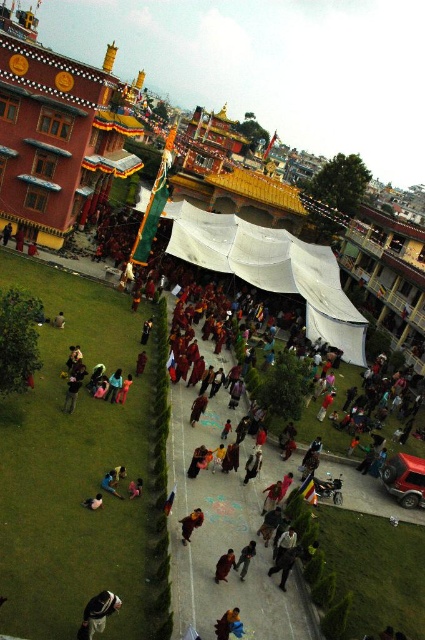
Question: Which point is closer to the camera taking this photo?

Choices:
 (A) (277, 234)
 (B) (189, 540)
 (C) (232, 556)
 (D) (133, 497)

Answer: (C)

Question: Is white fabric bag at lower left positioned at the back of light blue fabric at lower center?

Choices:
 (A) yes
 (B) no

Answer: (B)

Question: Which object is closer to the camera taking this photo?

Choices:
 (A) dark brown leather jacket at lower left
 (B) white fabric bag at lower left
 (C) white fabric canopy at center
 (D) dark brown monk at center

Answer: (B)

Question: Does orange fabric at lower center appear on the left side of dark brown leather jacket at center?

Choices:
 (A) no
 (B) yes

Answer: (B)

Question: Is white fabric bag at lower left thinner than dark brown leather jacket at lower left?

Choices:
 (A) no
 (B) yes

Answer: (A)

Question: Which of the following is the farthest from the observer?

Choices:
 (A) dark blue fabric at lower left
 (B) light blue fabric at lower center

Answer: (B)